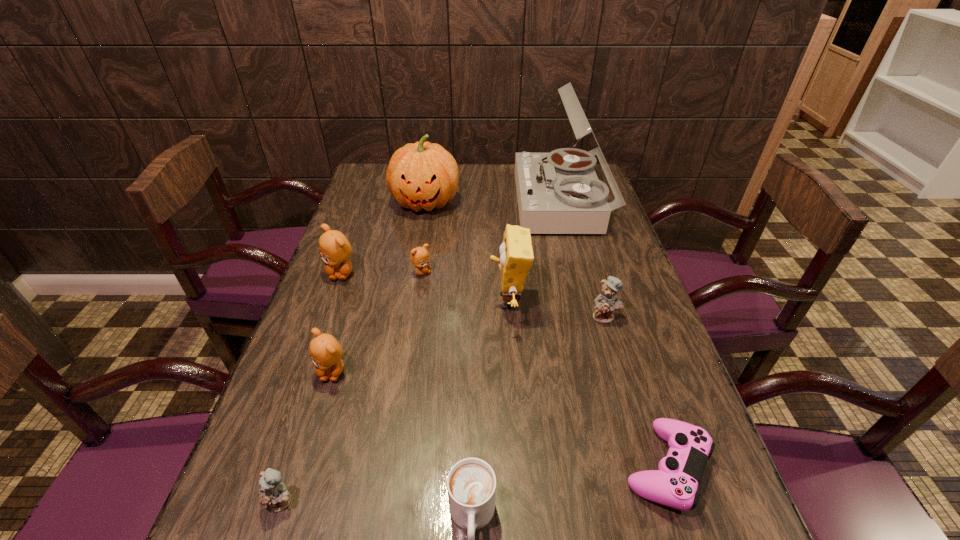
Where is `record player that is at the right edge`? This screenshot has width=960, height=540. record player that is at the right edge is located at coordinates (559, 192).

I want to click on teddy bear positioned at the right edge, so click(605, 303).

The image size is (960, 540). In order to click on control that is at the right edge in this screenshot , I will do `click(675, 484)`.

At what (x,y) coordinates should I click in order to perform the action: click on object that is positioned at the far left corner. Please return your answer as a coordinate pair (x, y). This screenshot has width=960, height=540. Looking at the image, I should click on (424, 175).

This screenshot has height=540, width=960. I want to click on object that is at the far right corner, so (x=559, y=192).

Identify the location of vacant space at the left edge. Image resolution: width=960 pixels, height=540 pixels. pyautogui.click(x=309, y=384).

This screenshot has height=540, width=960. Find the location of `blank space at the right edge`. blank space at the right edge is located at coordinates (x=646, y=309).

The width and height of the screenshot is (960, 540). Find the location of `vacant area at the far left corner of the desktop`. vacant area at the far left corner of the desktop is located at coordinates (371, 180).

Locate an element on the screen. The image size is (960, 540). vacant point located between the biggest brown teddy bear and the record player is located at coordinates (451, 238).

Find the location of a particular element. Image resolution: width=960 pixels, height=540 pixels. vacant point located between the eighth shortest object and the second teddy bear from right to left is located at coordinates click(x=465, y=287).